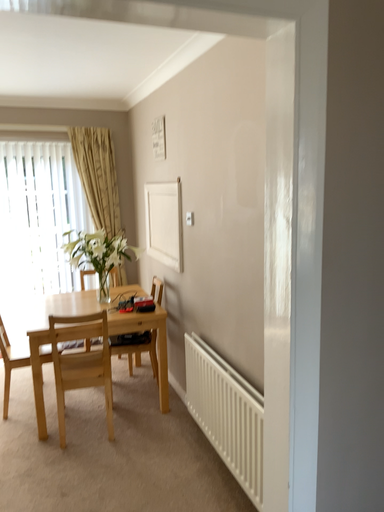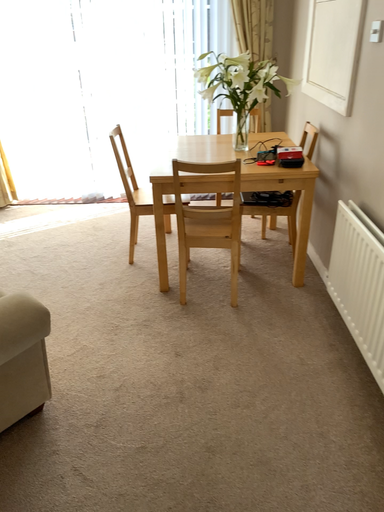
Question: How did the camera likely rotate when shooting the video?

Choices:
 (A) rotated left
 (B) rotated right

Answer: (A)